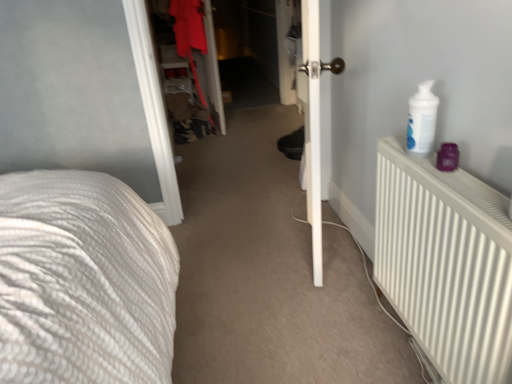
Question: In the image, is white smooth door at center on the left side or the right side of white matte radiator at right?

Choices:
 (A) left
 (B) right

Answer: (A)

Question: Is white smooth door at center wider or thinner than white matte radiator at right?

Choices:
 (A) wide
 (B) thin

Answer: (A)

Question: Which is nearer to the white smooth door at center?

Choices:
 (A) white matte radiator at right
 (B) matte red coat at center

Answer: (A)

Question: Considering the real-world distances, which object is farthest from the white smooth door at center?

Choices:
 (A) white matte radiator at right
 (B) matte red coat at center

Answer: (B)